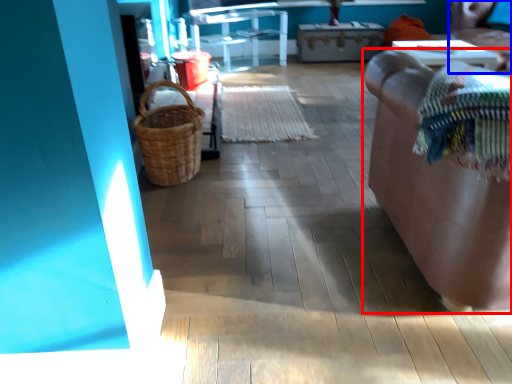
Question: Which point is further to the camera, furniture (highlighted by a red box) or chair (highlighted by a blue box)?

Choices:
 (A) furniture
 (B) chair

Answer: (B)